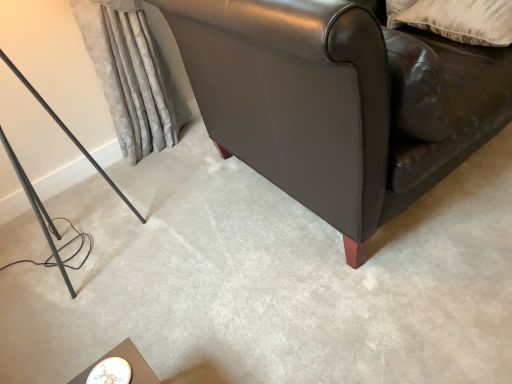
Question: From the image's perspective, is leather couch at lower right on top of matte black leather couch at upper right?

Choices:
 (A) yes
 (B) no

Answer: (A)

Question: From a real-world perspective, is leather couch at lower right beneath matte black leather couch at upper right?

Choices:
 (A) yes
 (B) no

Answer: (B)

Question: Can matte black leather couch at upper right be found inside leather couch at lower right?

Choices:
 (A) yes
 (B) no

Answer: (B)

Question: From a real-world perspective, is leather couch at lower right positioned over matte black leather couch at upper right based on gravity?

Choices:
 (A) yes
 (B) no

Answer: (A)

Question: Can you confirm if leather couch at lower right is thinner than matte black leather couch at upper right?

Choices:
 (A) yes
 (B) no

Answer: (A)

Question: In terms of height, does silky gray curtain at left look taller or shorter compared to marble top table at lower left?

Choices:
 (A) tall
 (B) short

Answer: (A)

Question: From the image's perspective, is silky gray curtain at left located above or below marble top table at lower left?

Choices:
 (A) below
 (B) above

Answer: (B)

Question: Is silky gray curtain at left in front of or behind marble top table at lower left in the image?

Choices:
 (A) front
 (B) behind

Answer: (B)

Question: Looking at the image, does silky gray curtain at left seem bigger or smaller compared to marble top table at lower left?

Choices:
 (A) small
 (B) big

Answer: (B)

Question: Considering the positions of point (352, 105) and point (170, 122), is point (352, 105) closer or farther from the camera than point (170, 122)?

Choices:
 (A) closer
 (B) farther

Answer: (A)

Question: From a real-world perspective, relative to silky gray curtain at left, is leather couch at lower right vertically above or below?

Choices:
 (A) below
 (B) above

Answer: (B)

Question: In the image, is leather couch at lower right on the left side or the right side of silky gray curtain at left?

Choices:
 (A) left
 (B) right

Answer: (B)

Question: In the image, is leather couch at lower right positioned in front of or behind silky gray curtain at left?

Choices:
 (A) behind
 (B) front

Answer: (B)

Question: Looking at the image, does beige textured pillow at upper right seem bigger or smaller compared to silky gray curtain at left?

Choices:
 (A) big
 (B) small

Answer: (B)

Question: In terms of height, does beige textured pillow at upper right look taller or shorter compared to silky gray curtain at left?

Choices:
 (A) tall
 (B) short

Answer: (B)